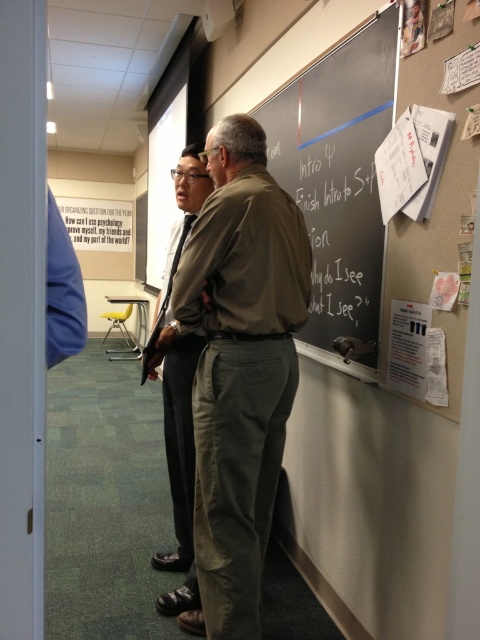
Question: Is black chalkboard writing at upper center further to the viewer compared to matte khaki pants at center?

Choices:
 (A) no
 (B) yes

Answer: (A)

Question: Is green matte shirt at center further to camera compared to matte khaki pants at center?

Choices:
 (A) yes
 (B) no

Answer: (B)

Question: Which object is positioned closest to the green matte shirt at center?

Choices:
 (A) black chalkboard at upper center
 (B) black chalkboard writing at upper center
 (C) matte khaki pants at center
 (D) white paper at right

Answer: (D)

Question: Which point appears closest to the camera in this image?

Choices:
 (A) (312, 221)
 (B) (188, 186)

Answer: (B)

Question: Does black chalkboard writing at upper center have a greater width compared to white paper at right?

Choices:
 (A) yes
 (B) no

Answer: (A)

Question: Considering the real-world distances, which object is farthest from the black chalkboard at upper center?

Choices:
 (A) matte khaki pants at center
 (B) white paper at right

Answer: (A)